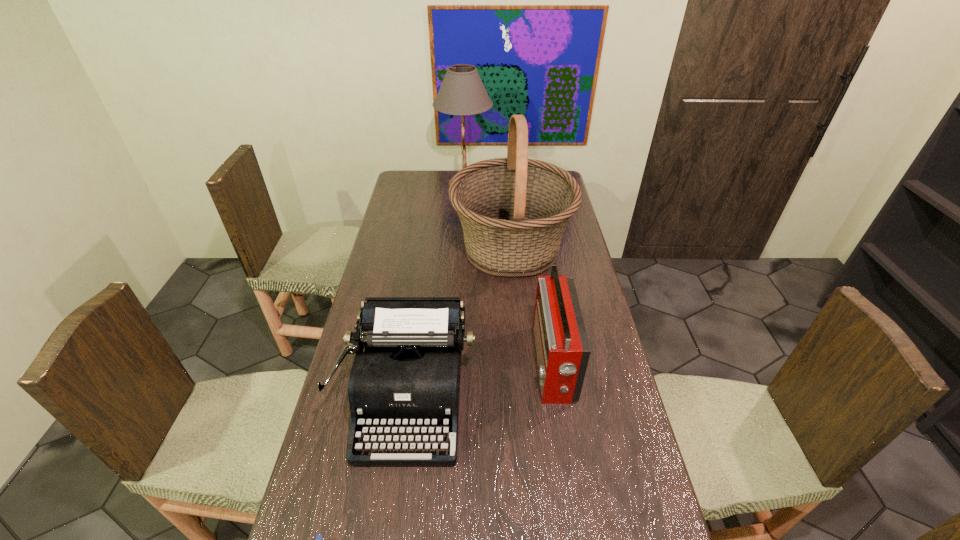
You are a GUI agent. You are given a task and a screenshot of the screen. Output one action in this format:
    pyautogui.click(x=<x>, y=<y>)
    Task: Click on the table lamp
    The width and height of the screenshot is (960, 540).
    Given the screenshot: What is the action you would take?
    pyautogui.click(x=462, y=92)

Identify the location of basket. The width and height of the screenshot is (960, 540). (513, 211).

I want to click on radio receiver, so click(562, 348).

This screenshot has height=540, width=960. What are the coordinates of `the fourth tallest object` in the screenshot? It's located at (408, 377).

Locate an element on the screen. This screenshot has width=960, height=540. free space located 0.350m on the front-facing side of the table lamp is located at coordinates (562, 183).

Locate an element on the screen. The width and height of the screenshot is (960, 540). free space located 0.370m on the back of the basket is located at coordinates (505, 176).

Locate an element on the screen. Image resolution: width=960 pixels, height=540 pixels. free space located 0.170m on the front-facing side of the radio receiver is located at coordinates (478, 365).

Where is `vacant space located 0.180m on the front-facing side of the radio receiver`? vacant space located 0.180m on the front-facing side of the radio receiver is located at coordinates [475, 365].

I want to click on vacant area situated on the front-facing side of the radio receiver, so click(x=478, y=365).

You are a GUI agent. You are given a task and a screenshot of the screen. Output one action in this format:
    pyautogui.click(x=<x>, y=<y>)
    Task: Click on the free space located on the typing side of the typewriter
    This screenshot has height=540, width=960.
    Given the screenshot: What is the action you would take?
    pyautogui.click(x=389, y=533)